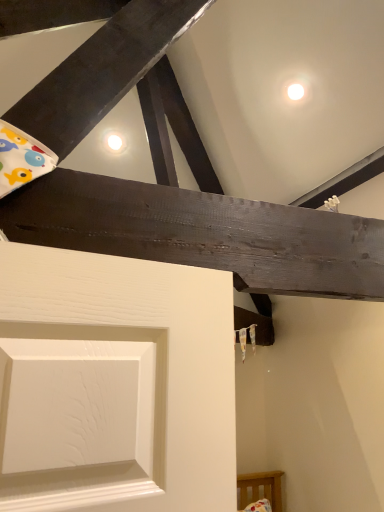
What do you see at coordinates (259, 488) in the screenshot? This screenshot has height=512, width=384. I see `light brown wooden bed frame at lower right` at bounding box center [259, 488].

Locate an element on the screen. This screenshot has height=512, width=384. light brown wooden bed frame at lower right is located at coordinates (259, 488).

I want to click on light brown wooden bed frame at lower right, so click(259, 488).